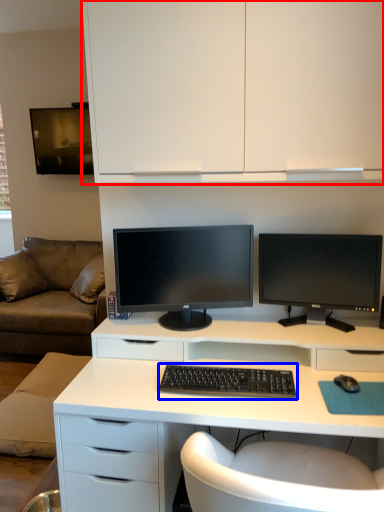
Question: Which point is closer to the camera, cabinetry (highlighted by a red box) or computer keyboard (highlighted by a blue box)?

Choices:
 (A) cabinetry
 (B) computer keyboard

Answer: (A)